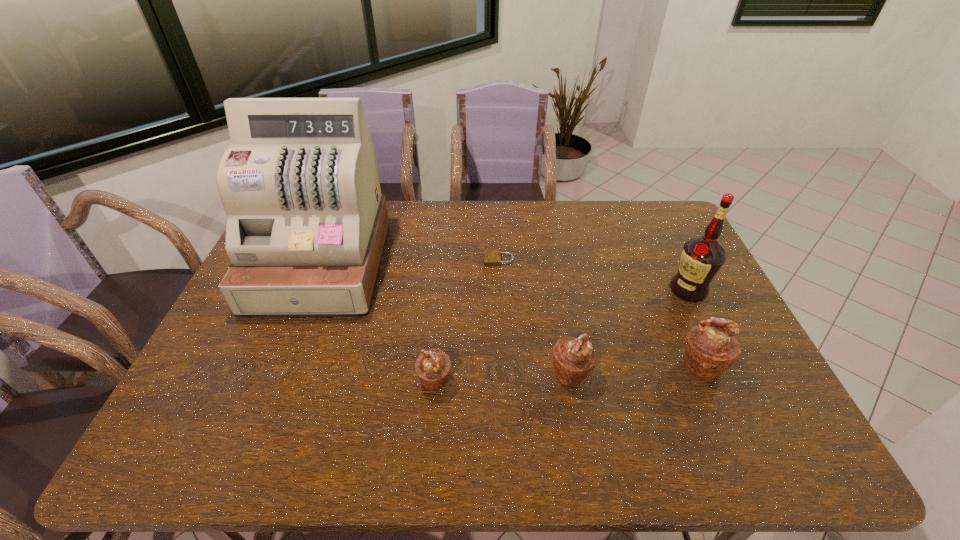
Locate an element on the screen. This screenshot has height=540, width=960. the fourth closest object to the padlock is located at coordinates (702, 257).

Locate an element on the screen. The image size is (960, 540). object that is the fourth closest one to the leftmost object is located at coordinates (711, 349).

Identify which muffin is the second closest to the shortest muffin. Please provide its 2D coordinates. Your answer should be formatted as a tuple, i.e. [(x, y)], where the tuple contains the x and y coordinates of a point satisfying the conditions above.

[(711, 349)]

Locate which muffin is the second closest to the second tallest muffin. Please provide its 2D coordinates. Your answer should be formatted as a tuple, i.e. [(x, y)], where the tuple contains the x and y coordinates of a point satisfying the conditions above.

[(433, 366)]

The image size is (960, 540). Identify the location of vacant space that satisfies the following two spatial constraints: 1. on the back side of the leftmost muffin; 2. on the left side of the fourth tallest object. (436, 373).

Identify the location of free space that satisfies the following two spatial constraints: 1. on the operating side of the shortest muffin; 2. on the left side of the leftmost object. This screenshot has width=960, height=540. (275, 381).

This screenshot has width=960, height=540. I want to click on free space that satisfies the following two spatial constraints: 1. on the label of the fifth shortest object; 2. on the front side of the rightmost muffin, so click(725, 366).

I want to click on free point that satisfies the following two spatial constraints: 1. on the keyhole side of the padlock; 2. on the left side of the rightmost muffin, so click(504, 366).

At what (x,y) coordinates should I click in order to perform the action: click on vacant space that satisfies the following two spatial constraints: 1. on the back side of the shortest muffin; 2. on the right side of the second muffin from right to left. Please return your answer as a coordinate pair (x, y). Looking at the image, I should click on (436, 373).

Identify the location of free space that satisfies the following two spatial constraints: 1. on the operating side of the leftmost object; 2. on the right side of the fifth object from right to left. This screenshot has height=540, width=960. (275, 381).